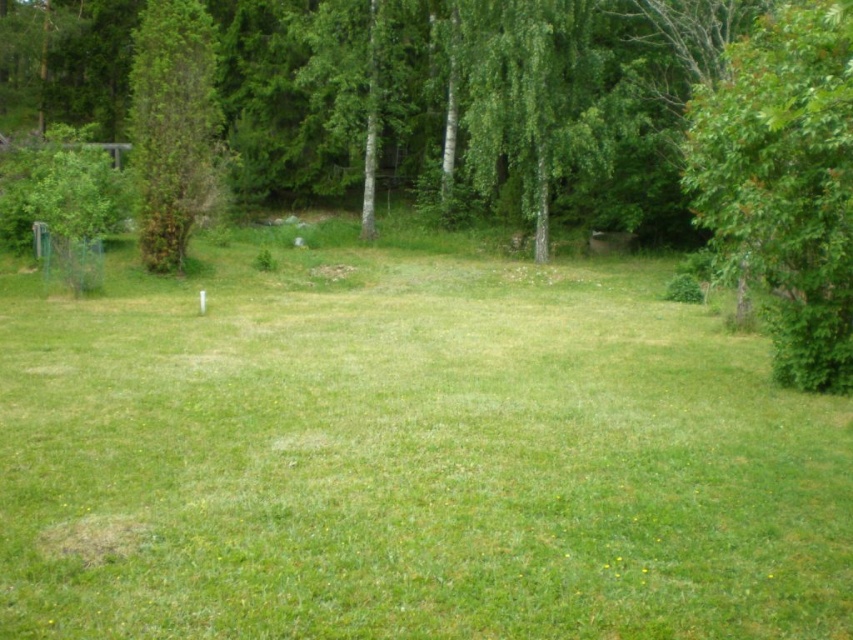
Question: Considering the real-world distances, which object is closest to the green leafy tree at left?

Choices:
 (A) green leafy tree at center
 (B) green grass at center

Answer: (A)

Question: Which object is closer to the camera taking this photo?

Choices:
 (A) green leafy tree at right
 (B) green grass at center
 (C) green leafy tree at left
 (D) green leafy tree at center

Answer: (B)

Question: Can you confirm if green leafy tree at center is positioned below green leafy tree at left?

Choices:
 (A) no
 (B) yes

Answer: (B)

Question: Does green grass at center appear under green leafy tree at left?

Choices:
 (A) no
 (B) yes

Answer: (B)

Question: Is green leafy tree at right above green leafy tree at left?

Choices:
 (A) yes
 (B) no

Answer: (B)

Question: Which of the following is the closest to the observer?

Choices:
 (A) (135, 68)
 (B) (798, 152)
 (C) (196, 74)

Answer: (B)